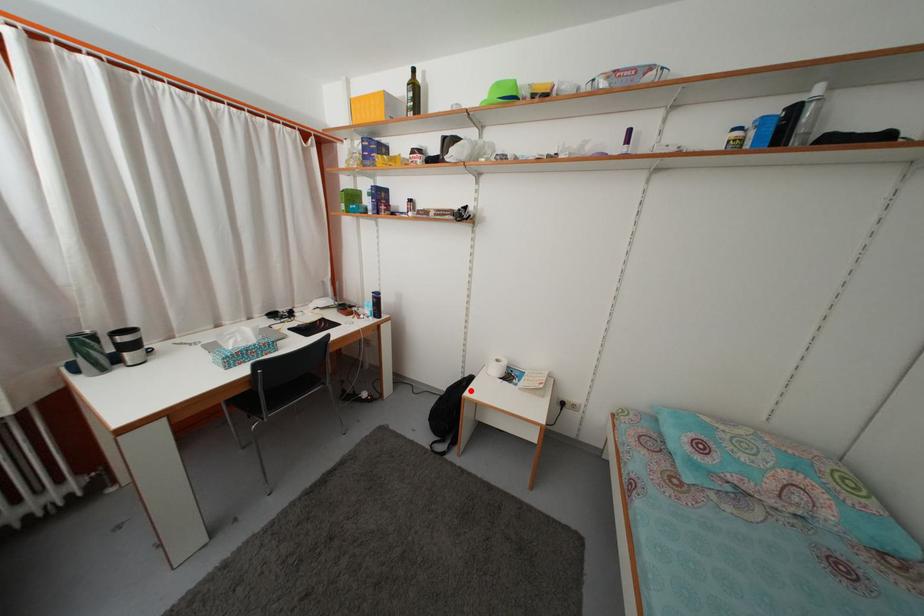
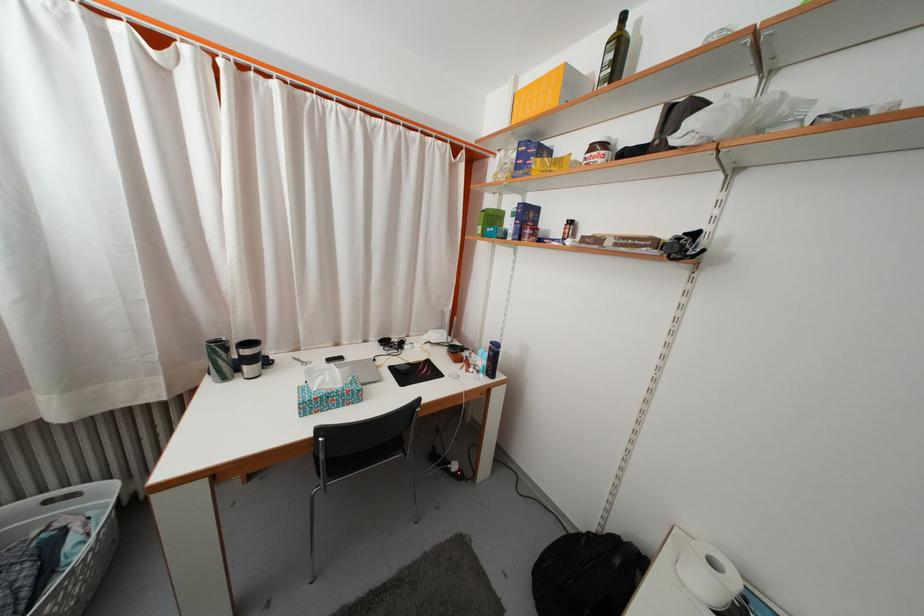
Find the pixel in the second image that matches the highlighted location in the first image.

(623, 568)